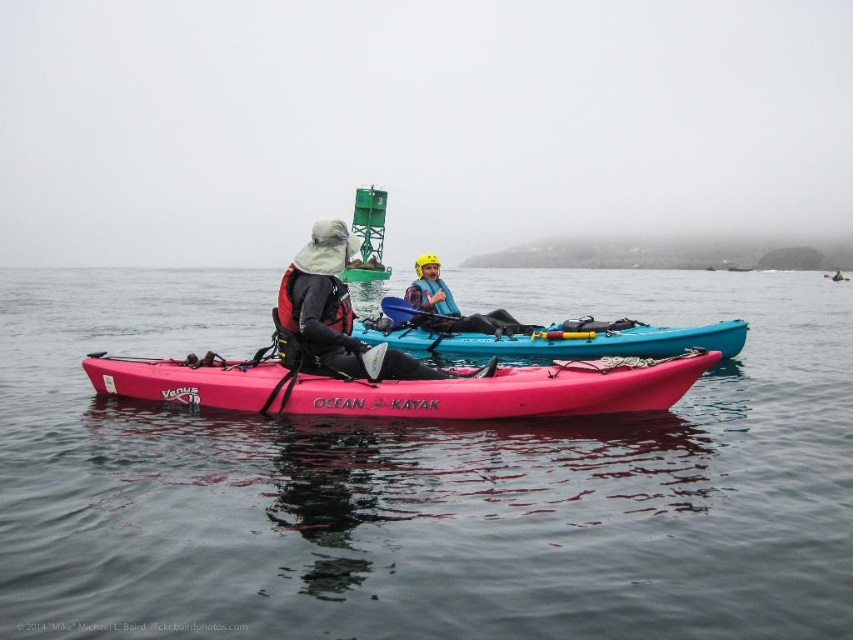
Does smooth dark water at center appear under foggy misty island at upper center?

Yes, smooth dark water at center is below foggy misty island at upper center.

Does smooth dark water at center have a lesser width compared to foggy misty island at upper center?

Yes, smooth dark water at center is thinner than foggy misty island at upper center.

Is point (718, 464) closer to viewer compared to point (567, 266)?

Yes, it is.

Find the location of a particular element. The height and width of the screenshot is (640, 853). smooth dark water at center is located at coordinates (422, 477).

Which is behind, point (602, 260) or point (834, 278)?

Positioned behind is point (602, 260).

Can you confirm if foggy misty island at upper center is taller than matte black kayak at center?

Yes, foggy misty island at upper center is taller than matte black kayak at center.

Who is more distant from viewer, (758, 260) or (839, 276)?

Positioned behind is point (758, 260).

The width and height of the screenshot is (853, 640). In order to click on foggy misty island at upper center in this screenshot , I will do `click(672, 253)`.

Between point (181, 497) and point (105, 362), which one is positioned behind?

The point (105, 362) is behind.

Does smooth dark water at center have a larger size compared to pink matte kayak at center?

Yes, smooth dark water at center is bigger than pink matte kayak at center.

Who is more forward, (12, 400) or (465, 417)?

Positioned in front is point (465, 417).

The height and width of the screenshot is (640, 853). Identify the location of smooth dark water at center. (422, 477).